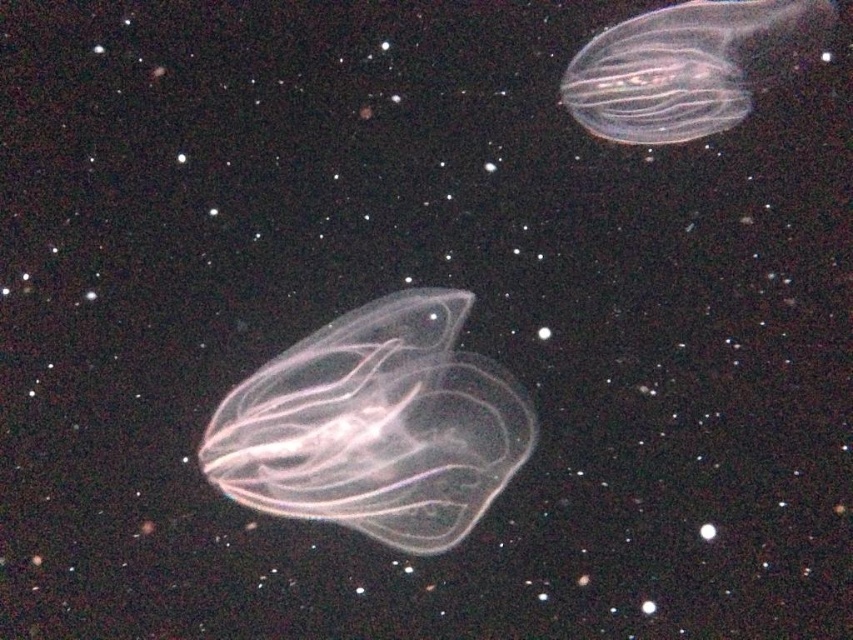
Question: From the image, what is the correct spatial relationship of transparent gelatinous at center in relation to transparent gelatinous at upper right?

Choices:
 (A) right
 (B) left

Answer: (B)

Question: Which object appears farthest from the camera in this image?

Choices:
 (A) transparent gelatinous at center
 (B) transparent gelatinous at upper right

Answer: (A)

Question: Observing the image, what is the correct spatial positioning of transparent gelatinous at center in reference to transparent gelatinous at upper right?

Choices:
 (A) above
 (B) below

Answer: (B)

Question: Does transparent gelatinous at center appear over transparent gelatinous at upper right?

Choices:
 (A) no
 (B) yes

Answer: (A)